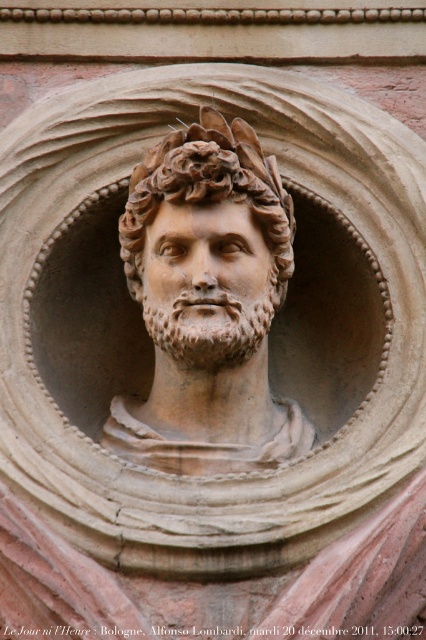
You are an art conservator examining a stone relief sculpture. You notice two points on the sculpture at coordinates point (226, 250) and point (195, 294). From your perspective in front of the sculpture, which point is closer to you?

Point (195, 294) is closer to you because the description states that point (226, 250) is behind point (195, 294).

Looking at the stone relief sculpture, where is the matte stone bust at center in relation to the rough stone face at center?

The matte stone bust at center is to the right of the rough stone face at center.

You are an archaeologist examining a stone relief sculpture. You notice a point marked at coordinates (x=207, y=304). Can you identify which part of the sculpture is exactly at that location?

The matte stone bust at center is located at point (x=207, y=304).